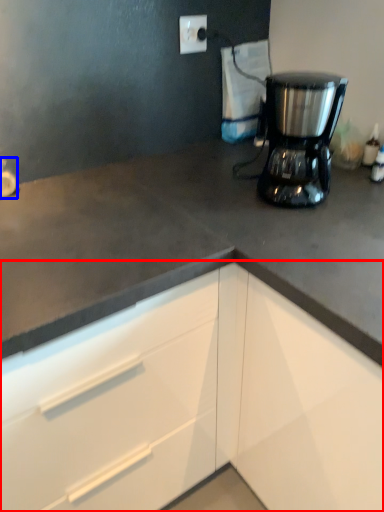
Question: Among these objects, which one is farthest to the camera, cabinetry (highlighted by a red box) or faucet (highlighted by a blue box)?

Choices:
 (A) cabinetry
 (B) faucet

Answer: (B)